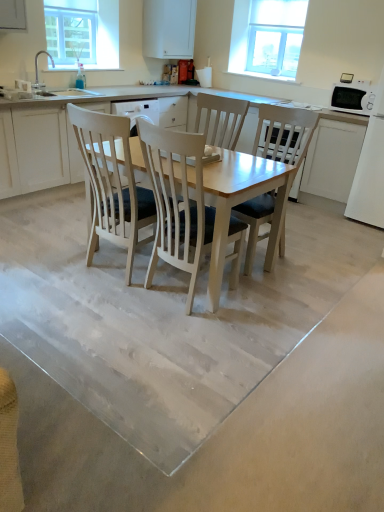
What do you see at coordinates (83, 33) in the screenshot?
I see `clear glass window screen at upper left` at bounding box center [83, 33].

This screenshot has width=384, height=512. Find the location of `clear glass window at upper right`. clear glass window at upper right is located at coordinates (267, 37).

Would you say clear glass window screen at upper left contains white matte cabinet at upper center, the second cabinetry viewed from the right?

That's incorrect, white matte cabinet at upper center, the second cabinetry viewed from the right, is not inside clear glass window screen at upper left.

Which is behind, clear glass window screen at upper left or white matte cabinet at upper center, which is the second cabinetry from left to right?

white matte cabinet at upper center, which is the second cabinetry from left to right.

Is clear glass window screen at upper left oriented towards white matte cabinet at upper center, the second cabinetry viewed from the right?

No, clear glass window screen at upper left is not facing towards white matte cabinet at upper center, the second cabinetry viewed from the right.

Based on their positions, is clear glass window screen at upper left located to the left or right of white matte cabinet at upper center, the second cabinetry viewed from the right?

clear glass window screen at upper left is positioned on white matte cabinet at upper center, the second cabinetry viewed from the right,'s left side.

Would you say clear glass window screen at upper left is part of light wood chair at center, the 2th chair from the left,'s contents?

That's incorrect, clear glass window screen at upper left is not inside light wood chair at center, the 2th chair from the left.

Looking at this image, is light wood chair at center, the 2th chair from the left, thinner than clear glass window screen at upper left?

In fact, light wood chair at center, the 2th chair from the left, might be wider than clear glass window screen at upper left.

Could you tell me if light wood chair at center, the 1th chair in the right-to-left sequence, is turned towards clear glass window screen at upper left?

No, light wood chair at center, the 1th chair in the right-to-left sequence, is not aimed at clear glass window screen at upper left.

From a real-world perspective, between clear glass window screen at upper left and smooth concrete floor at center, who is vertically higher?

clear glass window screen at upper left.

Between clear glass window screen at upper left and smooth concrete floor at center, which one appears on the right side from the viewer's perspective?

Positioned to the right is smooth concrete floor at center.

Does clear glass window screen at upper left lie behind smooth concrete floor at center?

Yes.

Is white wood chair at center, arranged as the 2th chair when viewed from the right, not close to white matte cabinet at left, arranged as the first cabinetry when viewed from the left?

Yes.

From a real-world perspective, count 1st chairs upward from the white matte cabinet at left, marked as the third cabinetry in a right-to-left arrangement, and point to it. Please provide its 2D coordinates.

[(177, 202)]

Considering the relative sizes of white wood chair at center, which appears as the 1th chair when viewed from the left, and white matte cabinet at left, marked as the third cabinetry in a right-to-left arrangement, in the image provided, is white wood chair at center, which appears as the 1th chair when viewed from the left, taller than white matte cabinet at left, marked as the third cabinetry in a right-to-left arrangement,?

Indeed, white wood chair at center, which appears as the 1th chair when viewed from the left, has a greater height compared to white matte cabinet at left, marked as the third cabinetry in a right-to-left arrangement.

From the picture: Is white wood chair at center, which appears as the 1th chair when viewed from the left, oriented away from white matte cabinet at left, marked as the third cabinetry in a right-to-left arrangement?

No, white wood chair at center, which appears as the 1th chair when viewed from the left,'s orientation is not away from white matte cabinet at left, marked as the third cabinetry in a right-to-left arrangement.

Is smooth concrete floor at center outside of clear glass window at upper right?

Indeed, smooth concrete floor at center is completely outside clear glass window at upper right.

How different are the orientations of smooth concrete floor at center and clear glass window at upper right in degrees?

The angular difference between smooth concrete floor at center and clear glass window at upper right is 1.24 degrees.

From a real-world perspective, is smooth concrete floor at center above or below clear glass window at upper right?

In terms of real-world spatial position, smooth concrete floor at center is below clear glass window at upper right.

Is smooth concrete floor at center looking in the opposite direction of clear glass window at upper right?

smooth concrete floor at center is not turned away from clear glass window at upper right.

In terms of width, does white matte cabinet at right, which appears as the first cabinetry when viewed from the right, look wider or thinner when compared to clear glass window screen at upper left?

white matte cabinet at right, which appears as the first cabinetry when viewed from the right, is wider than clear glass window screen at upper left.

Does white matte cabinet at right, which appears as the first cabinetry when viewed from the right, turn towards clear glass window screen at upper left?

No, white matte cabinet at right, which appears as the first cabinetry when viewed from the right, is not turned towards clear glass window screen at upper left.

Is white matte cabinet at right, which appears as the first cabinetry when viewed from the right, further to the viewer compared to clear glass window screen at upper left?

No, it is not.

From the picture: Is white matte cabinet at right, placed as the third cabinetry when sorted from left to right, far from clear glass window screen at upper left?

Absolutely, white matte cabinet at right, placed as the third cabinetry when sorted from left to right, is distant from clear glass window screen at upper left.

From the picture: Between white matte cabinet at right, which appears as the first cabinetry when viewed from the right, and white glossy microwave at upper right, which one has larger size?

With larger size is white matte cabinet at right, which appears as the first cabinetry when viewed from the right.

Which point is more distant from viewer, (328, 134) or (337, 98)?

The point (328, 134) is farther from the camera.

Looking at this image, can you confirm if white matte cabinet at right, placed as the third cabinetry when sorted from left to right, is taller than white glossy microwave at upper right?

Indeed, white matte cabinet at right, placed as the third cabinetry when sorted from left to right, has a greater height compared to white glossy microwave at upper right.

This screenshot has width=384, height=512. Find the location of `appliance behind the white matte cabinet at right, which appears as the first cabinetry when viewed from the right`. appliance behind the white matte cabinet at right, which appears as the first cabinetry when viewed from the right is located at coordinates (353, 97).

This screenshot has height=512, width=384. Identify the location of cabinetry above the clear glass window screen at upper left (from the image's perspective). (169, 28).

From a real-world perspective, count 1st chairs downward from the clear glass window screen at upper left and point to it. Please provide its 2D coordinates.

[(284, 134)]

Estimate the real-world distances between objects in this image. Which object is closer to white glossy microwave at upper right, smooth concrete floor at center or white wood chair at center, which appears as the 1th chair when viewed from the left?

white wood chair at center, which appears as the 1th chair when viewed from the left.

When comparing their distances from light wood chair at center, the 1th chair in the right-to-left sequence, does white matte cabinet at left, arranged as the first cabinetry when viewed from the left, or white matte cabinet at right, placed as the third cabinetry when sorted from left to right, seem closer?

Among the two, white matte cabinet at right, placed as the third cabinetry when sorted from left to right, is located nearer to light wood chair at center, the 1th chair in the right-to-left sequence.

Looking at this image, based on their spatial positions, is clear glass window screen at upper left or white matte cabinet at right, placed as the third cabinetry when sorted from left to right, closer to white glossy microwave at upper right?

white matte cabinet at right, placed as the third cabinetry when sorted from left to right, is closer to white glossy microwave at upper right.

Looking at the image, which one is located closer to clear glass window screen at upper left, white matte cabinet at right, which appears as the first cabinetry when viewed from the right, or white wood chair at center, which appears as the 1th chair when viewed from the left?

white matte cabinet at right, which appears as the first cabinetry when viewed from the right, is closer to clear glass window screen at upper left.

Which object lies nearer to the anchor point smooth concrete floor at center, clear glass window screen at upper left or light wood chair at center, the 2th chair from the left?

light wood chair at center, the 2th chair from the left, is closer to smooth concrete floor at center.

Looking at the image, which one is located closer to white matte cabinet at right, which appears as the first cabinetry when viewed from the right, clear glass window at upper right or smooth concrete floor at center?

clear glass window at upper right.

Based on their spatial positions, is white matte cabinet at left, arranged as the first cabinetry when viewed from the left, or white matte cabinet at right, placed as the third cabinetry when sorted from left to right, further from clear glass window screen at upper left?

Among the two, white matte cabinet at right, placed as the third cabinetry when sorted from left to right, is located further to clear glass window screen at upper left.

Based on their spatial positions, is clear glass window at upper right or white wood chair at center, arranged as the 2th chair when viewed from the right, closer to clear glass window screen at upper left?

Among the two, clear glass window at upper right is located nearer to clear glass window screen at upper left.

Identify the location of window located between white matte cabinet at left, arranged as the first cabinetry when viewed from the left, and white matte cabinet at right, which appears as the first cabinetry when viewed from the right, in the left-right direction. This screenshot has width=384, height=512. (267, 37).

In order to click on cabinetry between white matte cabinet at left, arranged as the first cabinetry when viewed from the left, and clear glass window at upper right, in the horizontal direction in this screenshot , I will do `click(169, 28)`.

Locate an element on the screen. chair between smooth concrete floor at center and white wood chair at center, arranged as the 2th chair when viewed from the right, from front to back is located at coordinates (284, 134).

The width and height of the screenshot is (384, 512). Find the location of `cabinetry between clear glass window screen at upper left and clear glass window at upper right`. cabinetry between clear glass window screen at upper left and clear glass window at upper right is located at coordinates (169, 28).